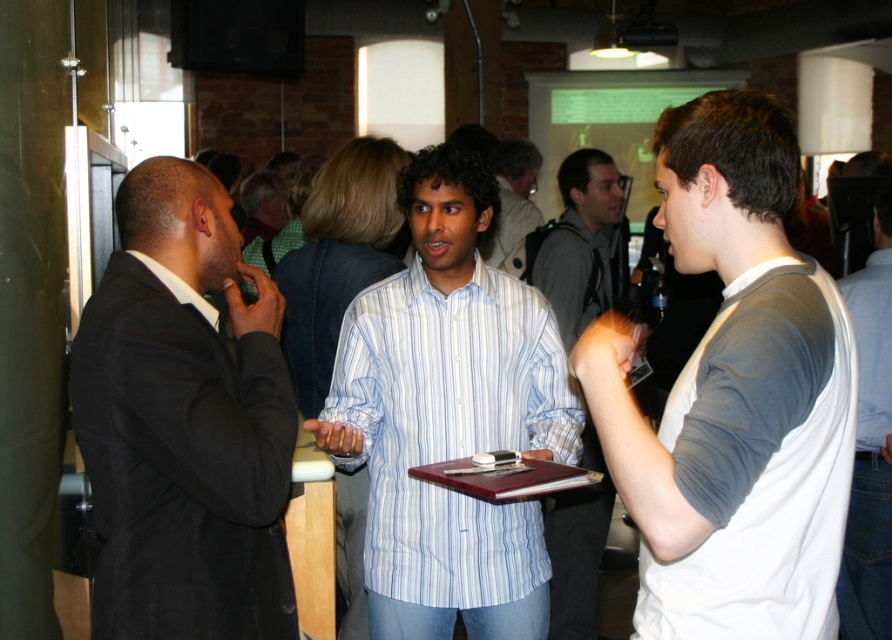
Question: Estimate the real-world distances between objects in this image. Which object is farther from the black matte suit at left?

Choices:
 (A) white striped shirt at center
 (B) white cotton t-shirt at right

Answer: (B)

Question: Is white cotton t-shirt at right smaller than black matte suit at left?

Choices:
 (A) no
 (B) yes

Answer: (B)

Question: Does white cotton t-shirt at right have a greater width compared to white striped shirt at center?

Choices:
 (A) no
 (B) yes

Answer: (A)

Question: Which point is closer to the camera taking this photo?

Choices:
 (A) (756, 170)
 (B) (884, 465)

Answer: (A)

Question: In this image, where is white cotton t-shirt at right located relative to white striped shirt at center?

Choices:
 (A) right
 (B) left

Answer: (A)

Question: Which point appears farthest from the camera in this image?

Choices:
 (A) (888, 563)
 (B) (271, 470)
 (C) (481, 253)

Answer: (C)